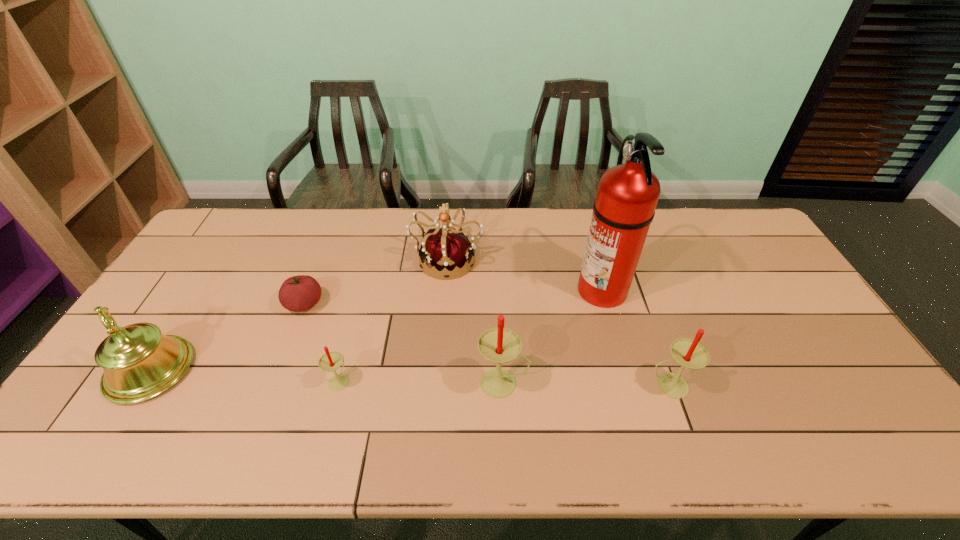
I want to click on vacant point located 0.110m on the right of the second candle from right to left, so pyautogui.click(x=571, y=383).

Identify the location of free space located 0.090m on the left of the rightmost candle. (612, 386).

Identify the location of free point located on the front-facing side of the tiara. This screenshot has height=540, width=960. (437, 387).

At what (x,y) coordinates should I click in order to perform the action: click on free space located on the left of the shortest object. Please return your answer as a coordinate pair (x, y). This screenshot has height=540, width=960. Looking at the image, I should click on (268, 305).

The width and height of the screenshot is (960, 540). What are the coordinates of `free space located 0.190m at the nozzle of the fire extinguisher` in the screenshot? It's located at (516, 289).

You are a GUI agent. You are given a task and a screenshot of the screen. Output one action in this format:
    pyautogui.click(x=<x>, y=<y>)
    Task: Click on the vacant area located 0.330m at the nozzle of the fire extinguisher
    Image resolution: width=960 pixels, height=540 pixels.
    Given the screenshot: What is the action you would take?
    pyautogui.click(x=470, y=289)

Locate an element on the screen. Image resolution: width=960 pixels, height=540 pixels. vacant space located 0.270m at the nozzle of the fire extinguisher is located at coordinates (490, 289).

Locate an element on the screen. Image resolution: width=960 pixels, height=540 pixels. free space located on the back of the bell is located at coordinates (202, 290).

This screenshot has height=540, width=960. Identify the location of object located at the far edge. (448, 251).

At what (x,y) coordinates should I click in order to perform the action: click on bell that is positioned at the near edge. Please return your answer as a coordinate pair (x, y). The height and width of the screenshot is (540, 960). Looking at the image, I should click on (139, 362).